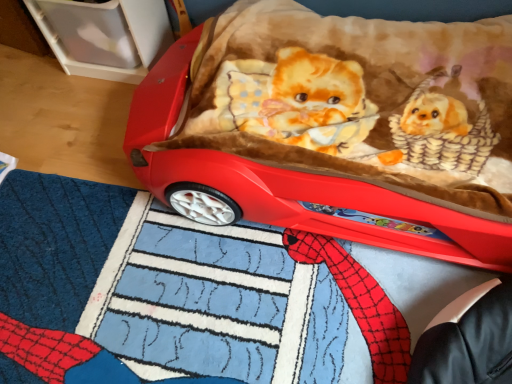
Question: From a real-world perspective, is matte plastic car at center positioned above or below blue plush mat at lower center?

Choices:
 (A) below
 (B) above

Answer: (B)

Question: Considering the positions of matte plastic car at center and blue plush mat at lower center in the image, is matte plastic car at center wider or thinner than blue plush mat at lower center?

Choices:
 (A) wide
 (B) thin

Answer: (B)

Question: From the image's perspective, relative to blue plush mat at lower center, is matte plastic car at center above or below?

Choices:
 (A) below
 (B) above

Answer: (B)

Question: From the image's perspective, is blue plush mat at lower center above or below matte plastic car at center?

Choices:
 (A) above
 (B) below

Answer: (B)

Question: Relative to matte plastic car at center, is blue plush mat at lower center in front or behind?

Choices:
 (A) behind
 (B) front

Answer: (B)

Question: Looking at their shapes, would you say blue plush mat at lower center is wider or thinner than matte plastic car at center?

Choices:
 (A) thin
 (B) wide

Answer: (B)

Question: Is blue plush mat at lower center bigger or smaller than matte plastic car at center?

Choices:
 (A) small
 (B) big

Answer: (A)